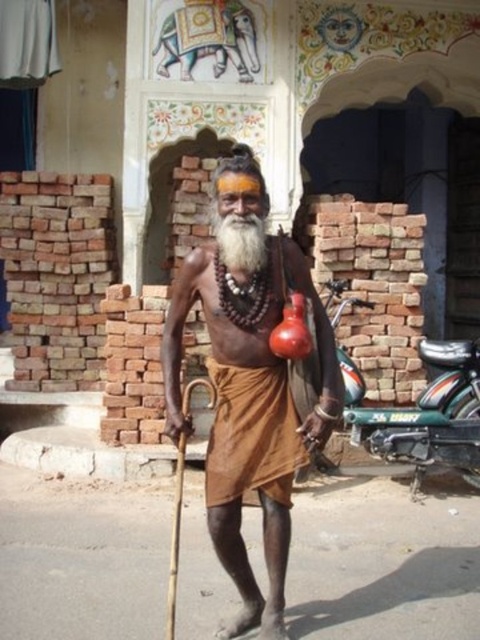
Question: Is brown matte cloth at center bigger than brown cotton dhoti at center?

Choices:
 (A) yes
 (B) no

Answer: (A)

Question: Observing the image, what is the correct spatial positioning of brown cotton dhoti at center in reference to white matte beard at center?

Choices:
 (A) left
 (B) right

Answer: (B)

Question: Observing the image, what is the correct spatial positioning of brown matte cloth at center in reference to green metallic motorcycle at lower right?

Choices:
 (A) right
 (B) left

Answer: (B)

Question: Which point is farther to the camera?

Choices:
 (A) coord(244,369)
 (B) coord(222,355)
 (C) coord(248,244)
 (D) coord(479,433)

Answer: (D)

Question: Which point is closer to the camera?

Choices:
 (A) brown cotton dhoti at center
 (B) white matte beard at center
 (C) green metallic motorcycle at lower right
 (D) brown matte cloth at center

Answer: (B)

Question: Which point appears closest to the camera in this image?

Choices:
 (A) (288, 467)
 (B) (457, 371)

Answer: (A)